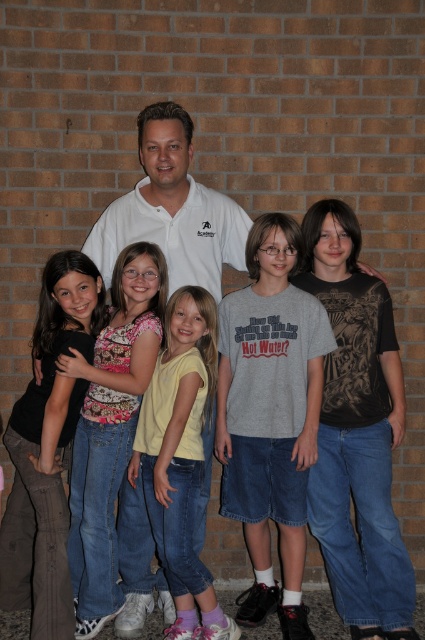
Does gray cotton t-shirt at center appear on the right side of yellow cotton shirt at center?

Indeed, gray cotton t-shirt at center is positioned on the right side of yellow cotton shirt at center.

Is gray cotton t-shirt at center above yellow cotton shirt at center?

Correct, gray cotton t-shirt at center is located above yellow cotton shirt at center.

What do you see at coordinates (271, 413) in the screenshot? Image resolution: width=425 pixels, height=640 pixels. I see `gray cotton t-shirt at center` at bounding box center [271, 413].

Locate an element on the screen. gray cotton t-shirt at center is located at coordinates (271, 413).

Between matte black shirt at left and denim jeans at left, which one is positioned higher?

matte black shirt at left is higher up.

Does matte black shirt at left appear on the left side of denim jeans at left?

Indeed, matte black shirt at left is positioned on the left side of denim jeans at left.

Does point (56, 321) lie in front of point (166, 266)?

Yes.

Image resolution: width=425 pixels, height=640 pixels. I want to click on matte black shirt at left, so click(x=48, y=449).

The image size is (425, 640). What do you see at coordinates (271, 413) in the screenshot? I see `gray cotton t-shirt at center` at bounding box center [271, 413].

Based on the photo, between gray cotton t-shirt at center and denim jeans at left, which one appears on the left side from the viewer's perspective?

From the viewer's perspective, denim jeans at left appears more on the left side.

Measure the distance between gray cotton t-shirt at center and camera.

gray cotton t-shirt at center and camera are 3.06 meters apart from each other.

The height and width of the screenshot is (640, 425). What are the coordinates of `gray cotton t-shirt at center` in the screenshot? It's located at (271, 413).